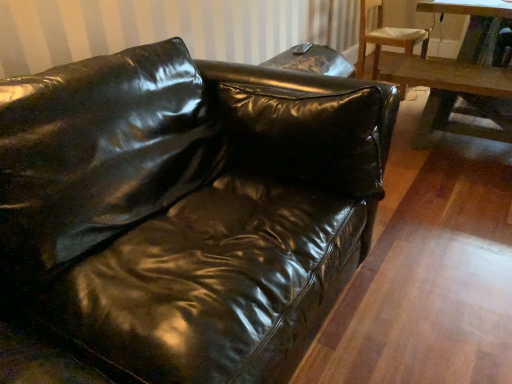
The width and height of the screenshot is (512, 384). Describe the element at coordinates (386, 37) in the screenshot. I see `wooden chair at upper right` at that location.

Identify the location of wooden table at right. This screenshot has height=384, width=512. (450, 93).

Can you tell me how much wooden table at right and wooden chair at upper right differ in facing direction?

There is a 95.7-degree angle between the facing directions of wooden table at right and wooden chair at upper right.

Does point (441, 127) come farther from viewer compared to point (376, 30)?

No, (441, 127) is closer to viewer.

Considering the sizes of objects wooden table at right and wooden chair at upper right in the image provided, who is taller, wooden table at right or wooden chair at upper right?

With more height is wooden chair at upper right.

Which object is further away from the camera taking this photo, wooden table at right or wooden chair at upper right?

wooden chair at upper right is further away from the camera.

From a real-world perspective, is glossy leather couch at center over wooden chair at upper right?

No, from a real-world perspective, glossy leather couch at center is not on top of wooden chair at upper right.

Between glossy leather couch at center and wooden chair at upper right, which one has larger width?

glossy leather couch at center is wider.

In the image, is glossy leather couch at center on the left side or the right side of wooden chair at upper right?

From the image, it's evident that glossy leather couch at center is to the left of wooden chair at upper right.

Which is correct: glossy leather couch at center is inside wooden table at right, or outside of it?

glossy leather couch at center lies outside wooden table at right.

Does glossy leather couch at center come in front of wooden table at right?

Yes, glossy leather couch at center is in front of wooden table at right.

Which point is more forward, [99,136] or [421,120]?

The point [99,136] is more forward.

Between glossy leather couch at center and wooden table at right, which one has smaller size?

Smaller between the two is wooden table at right.

Are wooden table at right and glossy leather couch at center far apart?

wooden table at right is positioned a significant distance from glossy leather couch at center.

Measure the distance from wooden table at right to glossy leather couch at center.

They are 1.57 meters apart.

From the image's perspective, between wooden table at right and glossy leather couch at center, which one is located above?

wooden table at right appears higher in the image.

Is wooden chair at upper right wider or thinner than wooden table at right?

wooden chair at upper right is wider than wooden table at right.

From the image's perspective, which one is positioned lower, wooden chair at upper right or wooden table at right?

wooden table at right appears lower in the image.

Is wooden chair at upper right facing away from wooden table at right?

No.

Is wooden chair at upper right closer to the viewer compared to wooden table at right?

No, wooden chair at upper right is behind wooden table at right.

Can you tell me how much wooden chair at upper right and glossy leather couch at center differ in facing direction?

5.8 degrees separate the facing orientations of wooden chair at upper right and glossy leather couch at center.

From the image's perspective, is wooden chair at upper right above or below glossy leather couch at center?

Based on their image positions, wooden chair at upper right is located above glossy leather couch at center.

Is wooden chair at upper right positioned in front of glossy leather couch at center?

No, it is behind glossy leather couch at center.

Could you tell me if wooden chair at upper right is facing glossy leather couch at center?

No, wooden chair at upper right is not turned towards glossy leather couch at center.

Locate an element on the screen. chair on the left of wooden table at right is located at coordinates click(x=386, y=37).

Locate an element on the screen. studio couch in front of the wooden chair at upper right is located at coordinates (186, 209).

From the image, which object appears to be farther from wooden table at right, glossy leather couch at center or wooden chair at upper right?

glossy leather couch at center.

Looking at the image, which one is located closer to wooden chair at upper right, glossy leather couch at center or wooden table at right?

Based on the image, wooden table at right appears to be nearer to wooden chair at upper right.

Based on their spatial positions, is wooden table at right or wooden chair at upper right closer to glossy leather couch at center?

wooden table at right lies closer to glossy leather couch at center than the other object.

Which object lies further to the anchor point wooden chair at upper right, wooden table at right or glossy leather couch at center?

glossy leather couch at center lies further to wooden chair at upper right than the other object.

From the image, which object appears to be farther from glossy leather couch at center, wooden chair at upper right or wooden table at right?

Based on the image, wooden chair at upper right appears to be further to glossy leather couch at center.

Which object lies nearer to the anchor point wooden table at right, wooden chair at upper right or glossy leather couch at center?

Based on the image, wooden chair at upper right appears to be nearer to wooden table at right.

I want to click on table positioned between glossy leather couch at center and wooden chair at upper right from near to far, so click(450, 93).